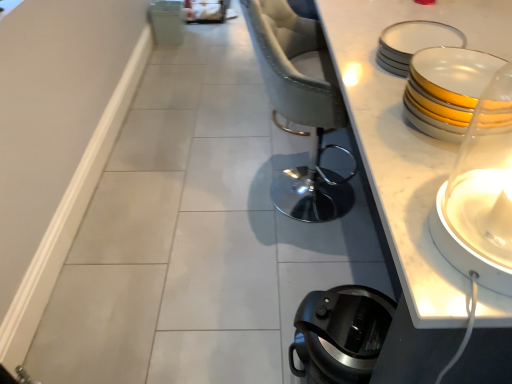
Identify the location of vacant region to the left of sleek gray fabric chair at center. Image resolution: width=512 pixels, height=384 pixels. (212, 188).